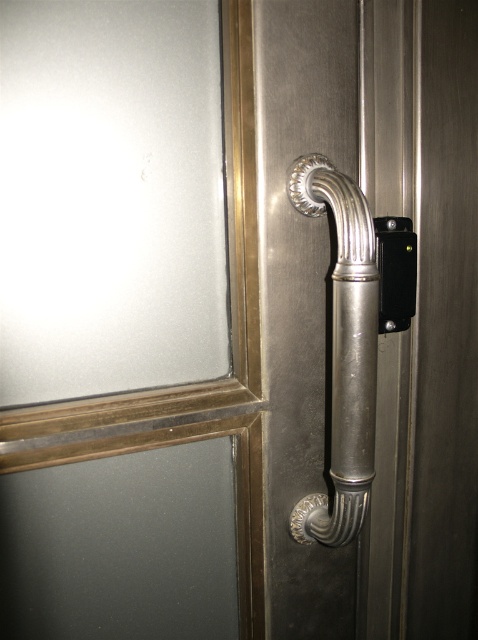
Question: Which point is closer to the camera?

Choices:
 (A) polished silver handle at right
 (B) frosted glass screen door at upper left

Answer: (B)

Question: Can you confirm if frosted glass screen door at upper left is bigger than polished silver handle at right?

Choices:
 (A) no
 (B) yes

Answer: (B)

Question: Estimate the real-world distances between objects in this image. Which object is closer to the frosted glass screen door at upper left?

Choices:
 (A) black plastic lock at center
 (B) polished silver handle at right

Answer: (B)

Question: Does frosted glass screen door at upper left appear on the right side of black plastic lock at center?

Choices:
 (A) yes
 (B) no

Answer: (B)

Question: Does frosted glass screen door at upper left appear on the left side of polished silver handle at right?

Choices:
 (A) yes
 (B) no

Answer: (A)

Question: Which point appears farthest from the camera in this image?

Choices:
 (A) (402, 323)
 (B) (246, 106)
 (C) (344, 451)

Answer: (A)